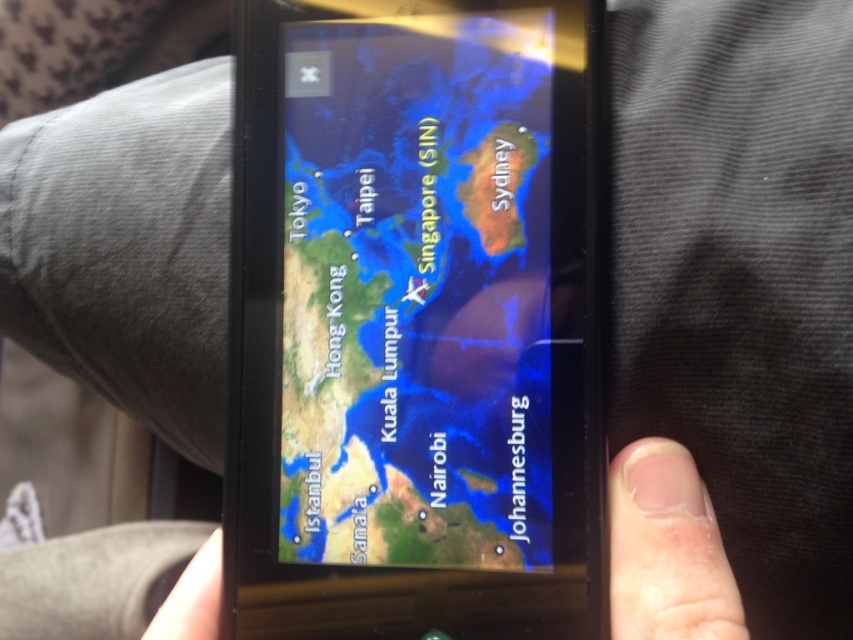
Based on the photo, you are using a smartphone to navigate and see the satellite map at center and the nail polish at lower right on the screen. Which object appears wider on the screen?

The nail polish at lower right is wider than the satellite map at center.